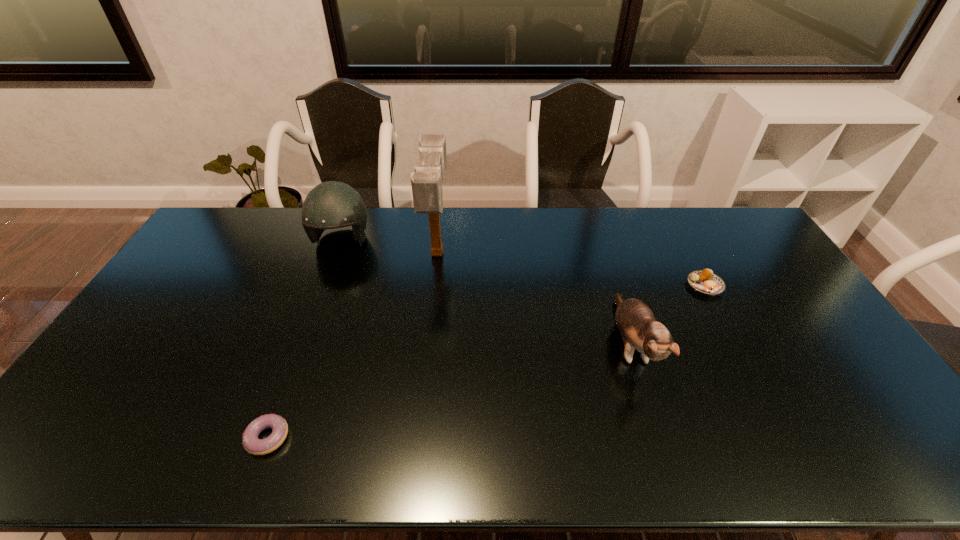
Choose which object is the second nearest neighbor to the football helmet. Please provide its 2D coordinates. Your answer should be formatted as a tuple, i.e. [(x, y)], where the tuple contains the x and y coordinates of a point satisfying the conditions above.

[(252, 444)]

Identify the location of free location that satisfies the following two spatial constraints: 1. at the face opening of the football helmet; 2. on the right side of the third object from right to left. Image resolution: width=960 pixels, height=540 pixels. (337, 253).